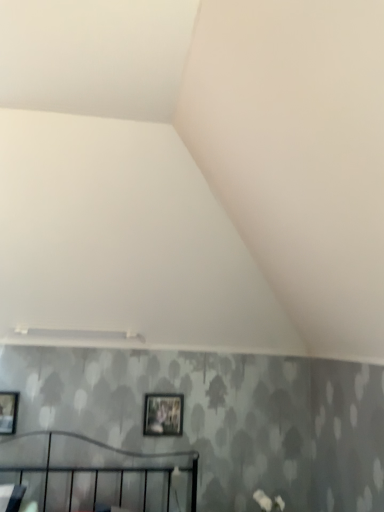
How much space does matte black picture frame at left, marked as the first picture frame in a left-to-right arrangement, occupy vertically?

The height of matte black picture frame at left, marked as the first picture frame in a left-to-right arrangement, is 11.43 inches.

Find the location of a particular element. white matte flower at lower right is located at coordinates (268, 502).

Which object is thinner, matte black picture frame at center, positioned as the 1th picture frame in right-to-left order, or white matte flower at lower right?

matte black picture frame at center, positioned as the 1th picture frame in right-to-left order.

Does point (147, 428) come behind point (260, 502)?

Yes, it is behind point (260, 502).

Is matte black picture frame at center, positioned as the 1th picture frame in right-to-left order, bigger than white matte flower at lower right?

No, matte black picture frame at center, positioned as the 1th picture frame in right-to-left order, is not bigger than white matte flower at lower right.

From a real-world perspective, is matte black picture frame at center, which is the second picture frame in left-to-right order, above or below white matte flower at lower right?

In terms of real-world spatial position, matte black picture frame at center, which is the second picture frame in left-to-right order, is above white matte flower at lower right.

Would you say matte black picture frame at left, the 1th picture frame viewed from the front, is outside white matte flower at lower right?

Yes, matte black picture frame at left, the 1th picture frame viewed from the front, is not within white matte flower at lower right.

Is matte black picture frame at left, the 2th picture frame viewed from the right, smaller than white matte flower at lower right?

Correct, matte black picture frame at left, the 2th picture frame viewed from the right, occupies less space than white matte flower at lower right.

Which object is wider, matte black picture frame at left, which is the 2th picture frame in back-to-front order, or white matte flower at lower right?

Wider between the two is white matte flower at lower right.

From the image's perspective, which is above, matte black picture frame at left, the 1th picture frame viewed from the front, or white matte flower at lower right?

From the image's view, matte black picture frame at left, the 1th picture frame viewed from the front, is above.

Based on the photo, is matte black picture frame at left, which is the 2th picture frame in back-to-front order, located outside matte black picture frame at center, positioned as the 2th picture frame in front-to-back order?

Yes.

Is there a large distance between matte black picture frame at left, which is the 2th picture frame in back-to-front order, and matte black picture frame at center, positioned as the 2th picture frame in front-to-back order?

Actually, matte black picture frame at left, which is the 2th picture frame in back-to-front order, and matte black picture frame at center, positioned as the 2th picture frame in front-to-back order, are a little close together.

From the image's perspective, is matte black picture frame at left, marked as the first picture frame in a left-to-right arrangement, under matte black picture frame at center, marked as the 1th picture frame in a back-to-front arrangement?

No, from the image's perspective, matte black picture frame at left, marked as the first picture frame in a left-to-right arrangement, is not beneath matte black picture frame at center, marked as the 1th picture frame in a back-to-front arrangement.

Relative to matte black picture frame at center, marked as the 1th picture frame in a back-to-front arrangement, is white matte flower at lower right in front or behind?

white matte flower at lower right is positioned closer to the viewer than matte black picture frame at center, marked as the 1th picture frame in a back-to-front arrangement.

Is white matte flower at lower right far away from matte black picture frame at center, positioned as the 2th picture frame in front-to-back order?

They are positioned close to each other.

Starting from the white matte flower at lower right, which picture frame is the 1st one to the left? Please provide its 2D coordinates.

[(163, 414)]

Can you tell me how much white matte flower at lower right and matte black picture frame at left, the 1th picture frame viewed from the front, differ in facing direction?

The angle between the facing direction of white matte flower at lower right and the facing direction of matte black picture frame at left, the 1th picture frame viewed from the front, is 0.964 degrees.

From the picture: Can we say white matte flower at lower right lies outside matte black picture frame at left, the 1th picture frame viewed from the front?

white matte flower at lower right is positioned outside matte black picture frame at left, the 1th picture frame viewed from the front.

Is white matte flower at lower right looking in the opposite direction of matte black picture frame at left, the 1th picture frame viewed from the front?

white matte flower at lower right does not have its back to matte black picture frame at left, the 1th picture frame viewed from the front.

From the image's perspective, is white matte flower at lower right located above or below matte black picture frame at left, which is the 2th picture frame in back-to-front order?

Clearly, from the image's perspective, white matte flower at lower right is below matte black picture frame at left, which is the 2th picture frame in back-to-front order.

Which point is more distant from viewer, (182, 424) or (1, 396)?

Positioned behind is point (182, 424).

Which object is positioned more to the right, matte black picture frame at center, positioned as the 2th picture frame in front-to-back order, or matte black picture frame at left, marked as the first picture frame in a left-to-right arrangement?

matte black picture frame at center, positioned as the 2th picture frame in front-to-back order, is more to the right.

From a real-world perspective, who is located higher, matte black picture frame at center, positioned as the 1th picture frame in right-to-left order, or matte black picture frame at left, marked as the first picture frame in a left-to-right arrangement?

matte black picture frame at center, positioned as the 1th picture frame in right-to-left order.

Is matte black picture frame at center, positioned as the 1th picture frame in right-to-left order, far from matte black picture frame at left, which is the 2th picture frame in back-to-front order?

No, matte black picture frame at center, positioned as the 1th picture frame in right-to-left order, is in close proximity to matte black picture frame at left, which is the 2th picture frame in back-to-front order.

Starting from the white matte flower at lower right, which picture frame is the 1st one to the left? Please provide its 2D coordinates.

[(163, 414)]

Where is `flower lying on the right of matte black picture frame at left, the 1th picture frame viewed from the front`? flower lying on the right of matte black picture frame at left, the 1th picture frame viewed from the front is located at coordinates (268, 502).

When comparing their distances from matte black picture frame at left, marked as the first picture frame in a left-to-right arrangement, does white matte flower at lower right or matte black picture frame at center, marked as the 1th picture frame in a back-to-front arrangement, seem further?

white matte flower at lower right is positioned further to the anchor matte black picture frame at left, marked as the first picture frame in a left-to-right arrangement.

From the image, which object appears to be farther from white matte flower at lower right, matte black picture frame at left, which is the 2th picture frame in back-to-front order, or matte black picture frame at center, marked as the 1th picture frame in a back-to-front arrangement?

Based on the image, matte black picture frame at left, which is the 2th picture frame in back-to-front order, appears to be further to white matte flower at lower right.

Based on their spatial positions, is white matte flower at lower right or matte black picture frame at left, the 2th picture frame viewed from the right, closer to matte black picture frame at center, positioned as the 1th picture frame in right-to-left order?

white matte flower at lower right is positioned closer to the anchor matte black picture frame at center, positioned as the 1th picture frame in right-to-left order.

Looking at the image, which one is located closer to white matte flower at lower right, matte black picture frame at center, positioned as the 1th picture frame in right-to-left order, or matte black picture frame at left, marked as the first picture frame in a left-to-right arrangement?

matte black picture frame at center, positioned as the 1th picture frame in right-to-left order, lies closer to white matte flower at lower right than the other object.

When comparing their distances from matte black picture frame at left, the 2th picture frame viewed from the right, does matte black picture frame at center, which is the second picture frame in left-to-right order, or white matte flower at lower right seem further?

white matte flower at lower right.

Estimate the real-world distances between objects in this image. Which object is closer to matte black picture frame at center, positioned as the 2th picture frame in front-to-back order, matte black picture frame at left, marked as the first picture frame in a left-to-right arrangement, or white matte flower at lower right?

Among the two, white matte flower at lower right is located nearer to matte black picture frame at center, positioned as the 2th picture frame in front-to-back order.

The image size is (384, 512). Find the location of `picture frame between matte black picture frame at left, which is the 2th picture frame in back-to-front order, and white matte flower at lower right`. picture frame between matte black picture frame at left, which is the 2th picture frame in back-to-front order, and white matte flower at lower right is located at coordinates (163, 414).